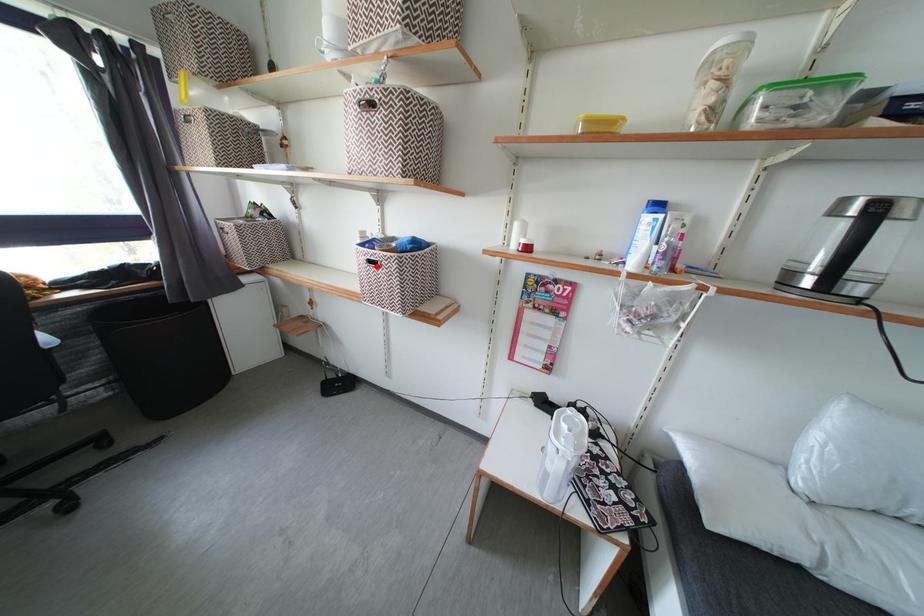
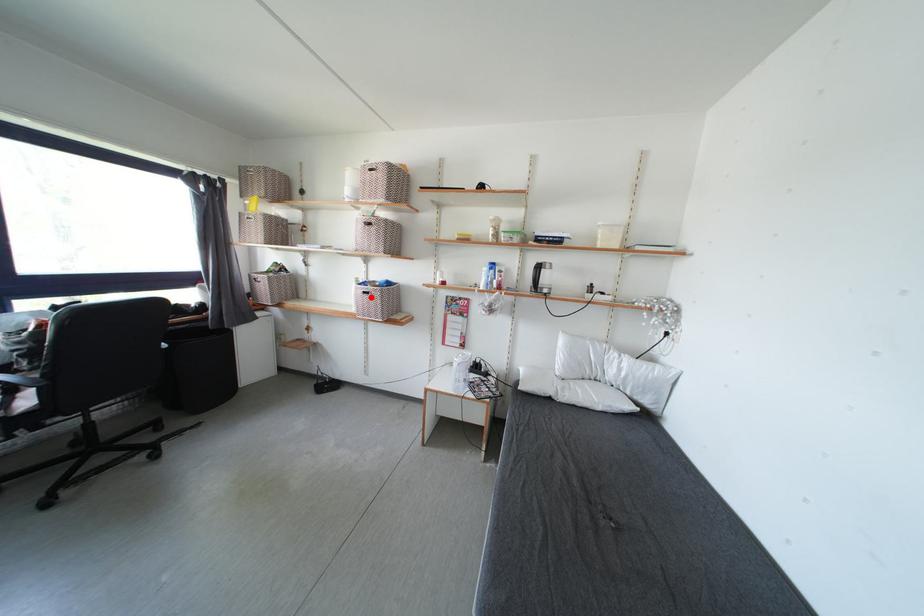
I am providing you with two images of the same scene from different viewpoints. A red point is marked on the first image and another point is marked on the second image. Does the point marked in image1 correspond to the same location as the one in image2?

Yes